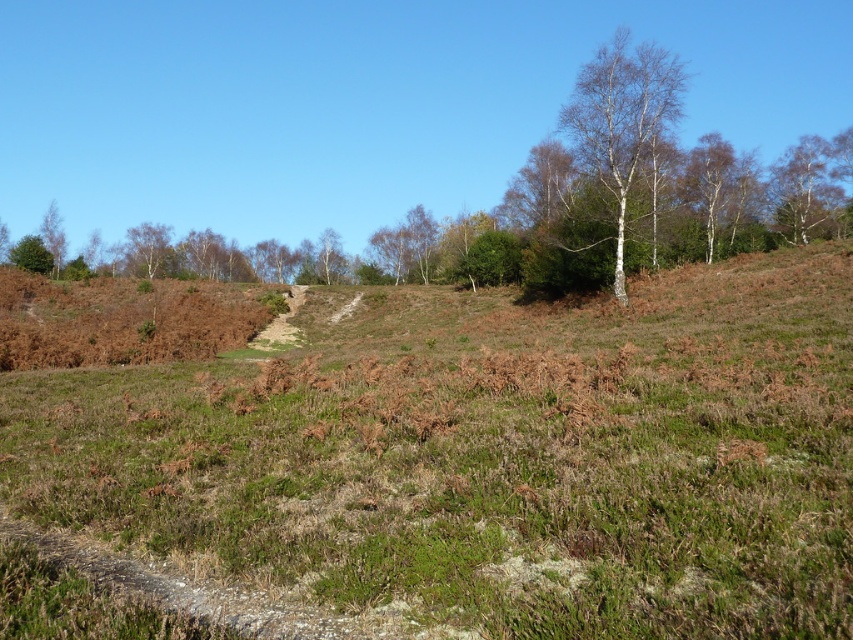
Question: Can you confirm if white smooth tree at upper right is positioned below green leafy tree at upper left?

Choices:
 (A) yes
 (B) no

Answer: (B)

Question: Does white bark tree at upper right appear over white smooth tree at upper right?

Choices:
 (A) yes
 (B) no

Answer: (B)

Question: Which of the following is the closest to the observer?

Choices:
 (A) (33, 426)
 (B) (22, 262)
 (C) (654, 100)
 (D) (64, 257)

Answer: (A)

Question: Which is nearer to the green leafy tree at upper left?

Choices:
 (A) smooth white tree at upper left
 (B) white bark tree at upper right

Answer: (A)

Question: Which of the following is the closest to the observer?

Choices:
 (A) (47, 214)
 (B) (349, 588)
 (C) (845, 152)
 (D) (573, 97)

Answer: (B)

Question: In this image, where is green grassy at center located relative to white smooth tree at upper right?

Choices:
 (A) left
 (B) right

Answer: (A)